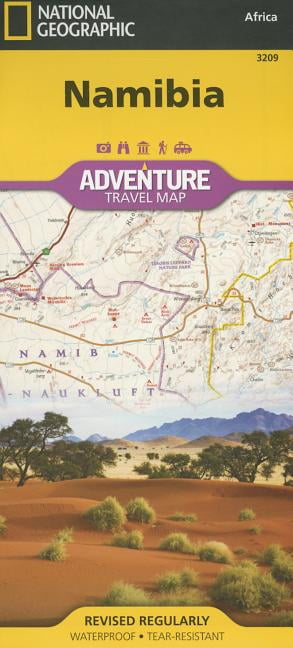
At what (x,y) coordinates should I click in order to perform the action: click on map. Please return your answer as a coordinate pair (x, y). Image resolution: width=293 pixels, height=648 pixels. Looking at the image, I should click on (14, 324), (137, 324), (268, 327), (22, 231), (141, 243), (242, 238).